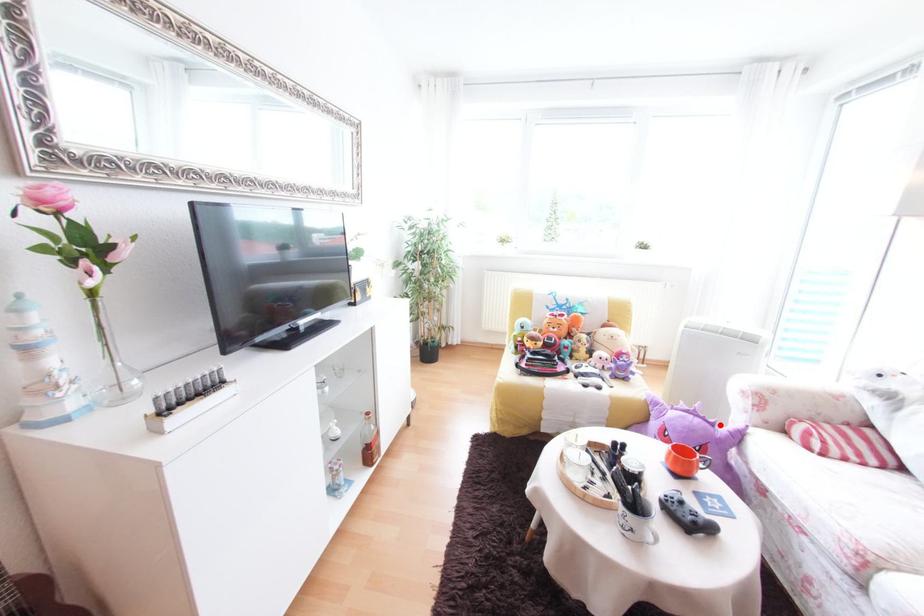
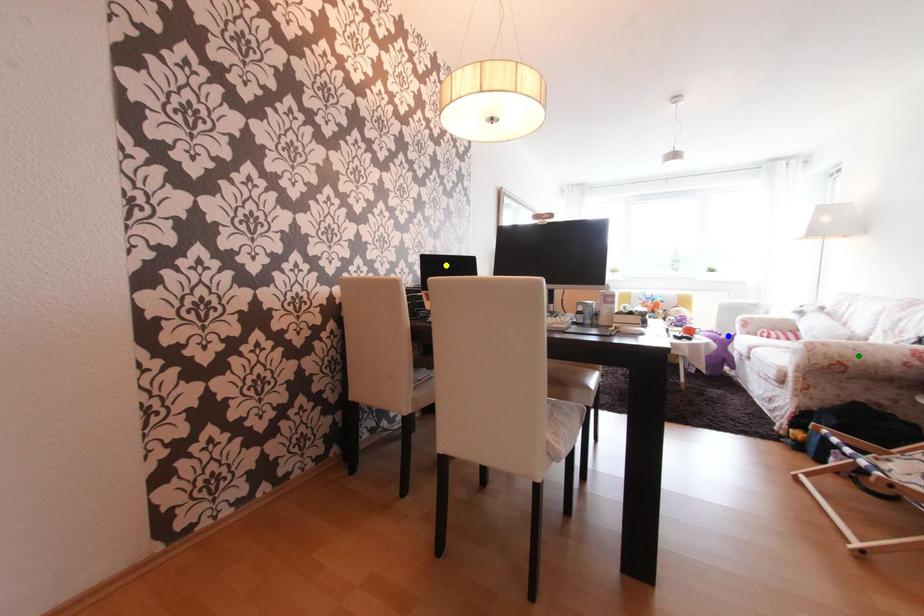
Question: I am providing you with two images of the same scene from different viewpoints. A red point is marked on the first image. You are given multiple points on the second image. Which mark in image 2 goes with the point in image 1?

Choices:
 (A) green point
 (B) blue point
 (C) yellow point

Answer: (B)